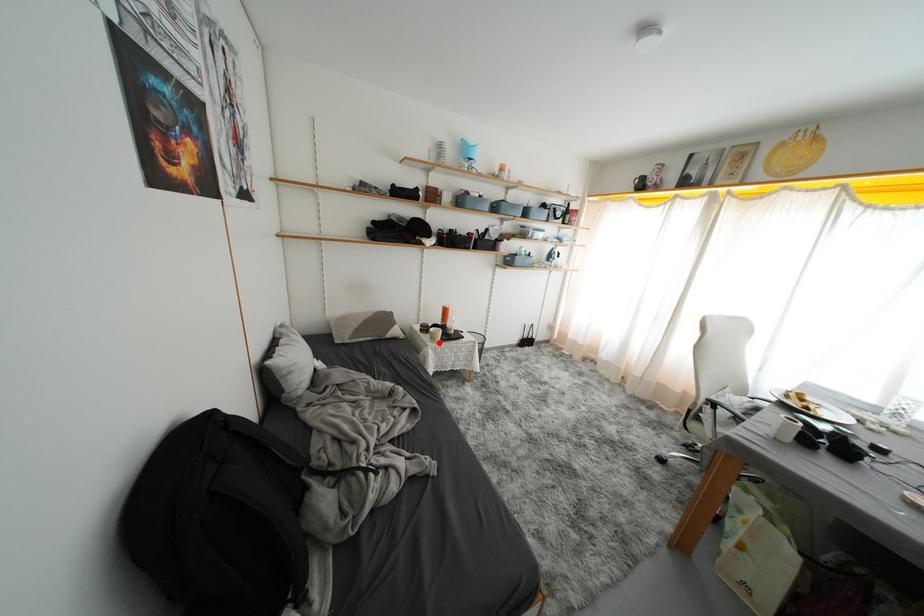
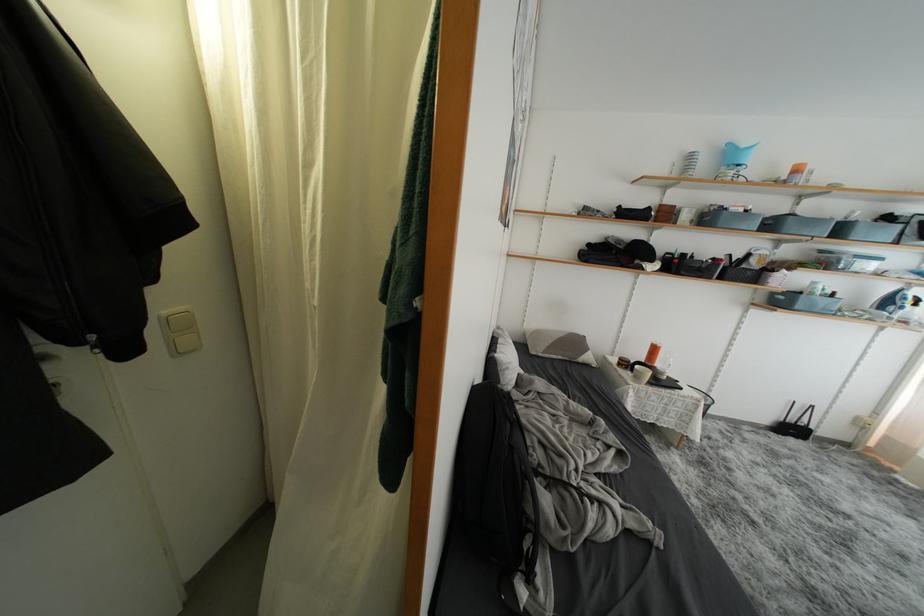
In the second image, find the point that corresponds to the highlighted location in the first image.

(642, 382)